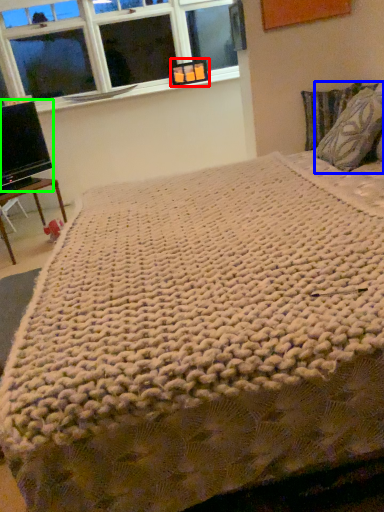
Question: Which object is positioned closest to picture frame (highlighted by a red box)? Select from pillow (highlighted by a blue box) and computer monitor (highlighted by a green box).

Choices:
 (A) pillow
 (B) computer monitor

Answer: (B)